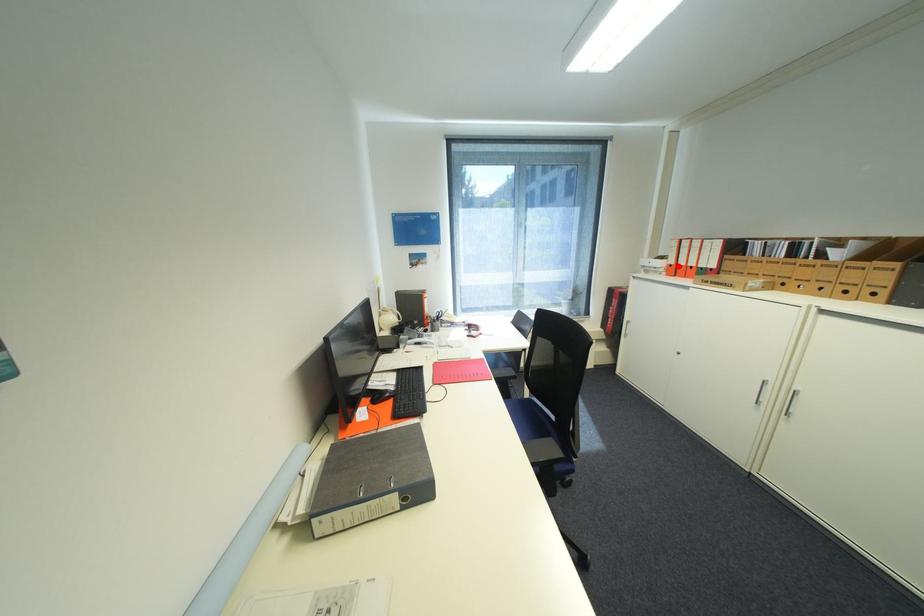
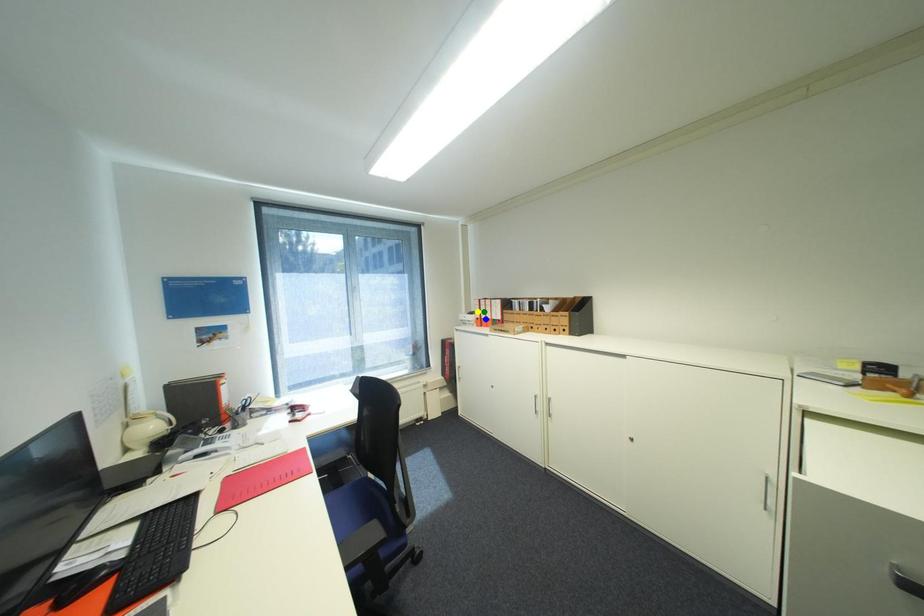
Question: I am providing you with two images of the same scene from different viewpoints. A red point is marked on the first image. You are given multiple points on the second image. Can you choose the point in image 2 that corresponds to the point in image 1?

Choices:
 (A) blue point
 (B) yellow point
 (C) green point

Answer: (A)